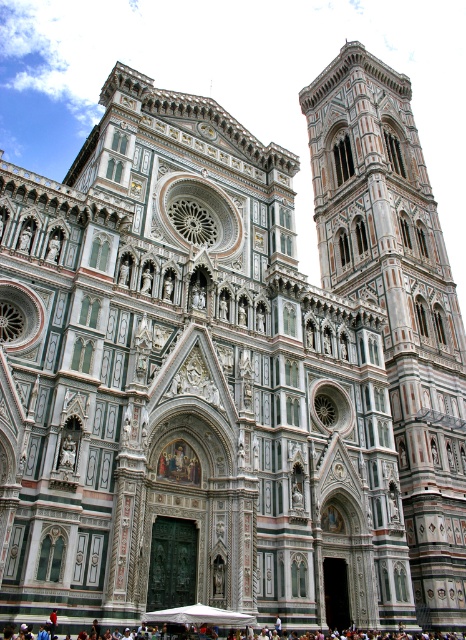
Locate an element on the screen. The width and height of the screenshot is (466, 640). white marble bell tower at right is located at coordinates (x=397, y=301).

Which is behind, point (438, 349) or point (169, 624)?

Positioned behind is point (438, 349).

Find the location of a particular element. This screenshot has width=466, height=640. white marble bell tower at right is located at coordinates (397, 301).